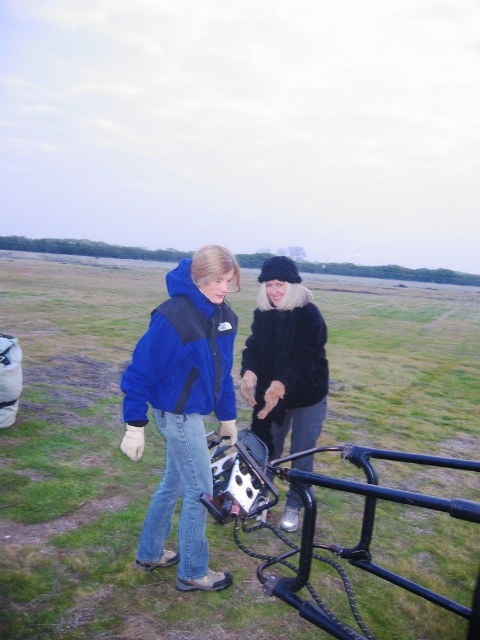
You are a photographer trying to fit both the black matte camera at center and the blue fleece jacket at center into a rectangular storage case. The case is exactly as wide as the camera. Can both items fit side by side horizontally?

The black matte camera at center is wider than the blue fleece jacket at center. Since the case is exactly as wide as the camera, there won not be enough space to fit both items side by side horizontally.

You are a photographer trying to capture a clear photo of both the blue fleece jacket at center and the black fur coat at center. The camera you are using has a minimum focus distance of 24 inches. Will you be able to focus on both subjects without moving the camera?

The blue fleece jacket at center is 23.54 inches away from the black fur coat at center. Since the minimum focus distance is 24 inches, the camera cannot focus on both subjects simultaneously as they are closer than the required distance.

You are a photographer trying to decide whether to carry both the black matte camera at center and the black fur coat at center in your backpack. Given their sizes, which one will take up more space?

The black matte camera at center has a larger width than the black fur coat at center, so it will take up more space in the backpack.